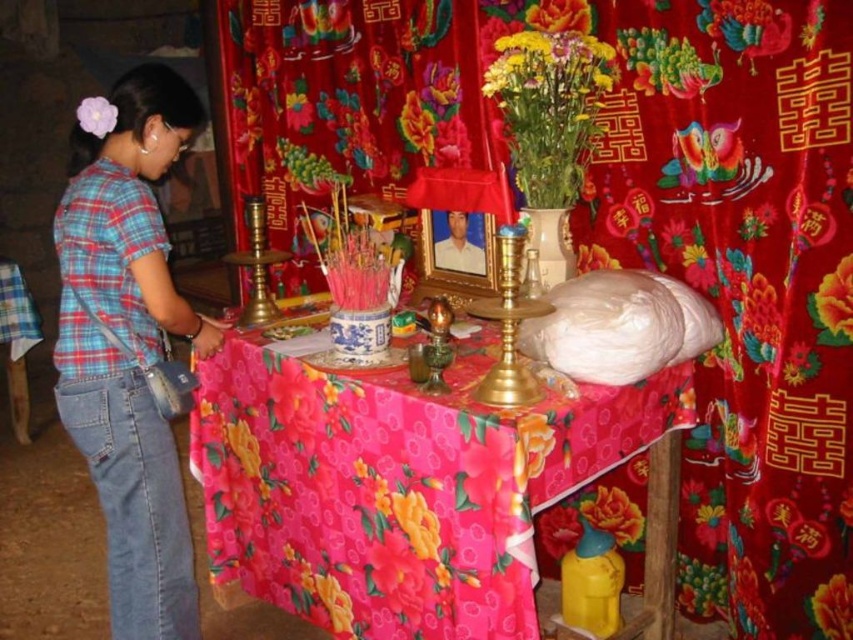
Question: Considering the relative positions of floral fabric tablecloth at center and floral fabric flower at lower right in the image provided, where is floral fabric tablecloth at center located with respect to floral fabric flower at lower right?

Choices:
 (A) right
 (B) left

Answer: (B)

Question: Which point is farther to the camera?

Choices:
 (A) (688, 168)
 (B) (404, 564)
 (C) (78, 112)
 (D) (573, 58)

Answer: (A)

Question: Is floral fabric flower at lower right below floral fabric at upper center?

Choices:
 (A) no
 (B) yes

Answer: (B)

Question: Among these points, which one is nearest to the camera?

Choices:
 (A) (181, 125)
 (B) (583, 509)

Answer: (A)

Question: Which of the following is the closest to the observer?

Choices:
 (A) vibrant yellow bouquet at upper center
 (B) floral fabric curtain at upper center
 (C) floral fabric at upper center

Answer: (B)

Question: Does floral fabric curtain at upper center appear over floral fabric flower at lower right?

Choices:
 (A) no
 (B) yes

Answer: (B)